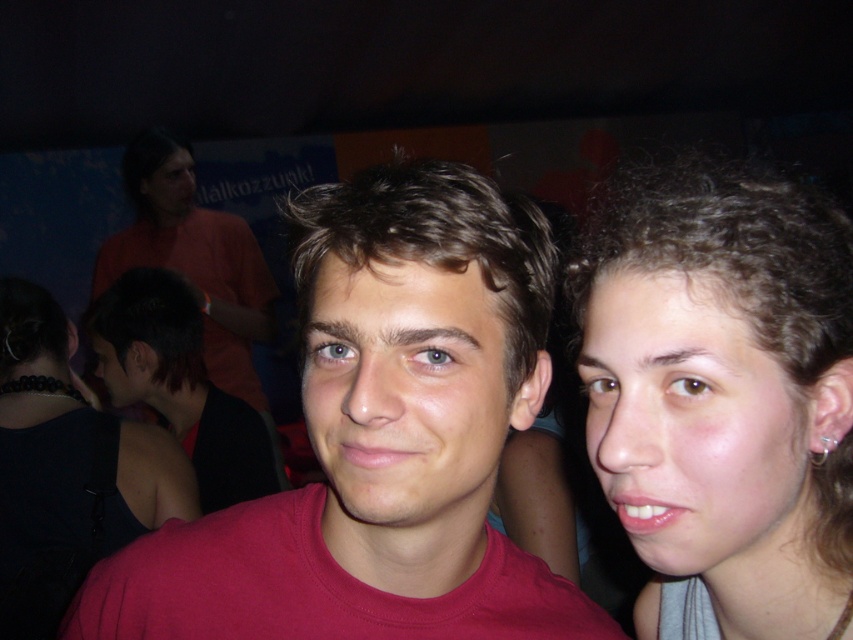
You are a photographer adjusting your camera settings to focus on the smooth skin face at right. The camera can only focus on objects exactly at the point specified. Is the smooth skin face at right located precisely at point (697, 429)?

Yes, the smooth skin face at right is located precisely at point (697, 429).

You are at a party and want to take a photo of the point at coordinates [614,401]. The camera you have can focus on objects within 15 inches. Will the point be in focus?

The distance of point [614,401] from camera is 16.63 inches, which is beyond the camera focus range of 15 inches. The point will not be in focus.

You are at a party and want to find the matte red t shirt at center. The coordinates given are point (380, 438). Can you confirm if this point is where the matte red t shirt at center is located?

Yes, the point (380, 438) corresponds to the matte red t shirt at center.